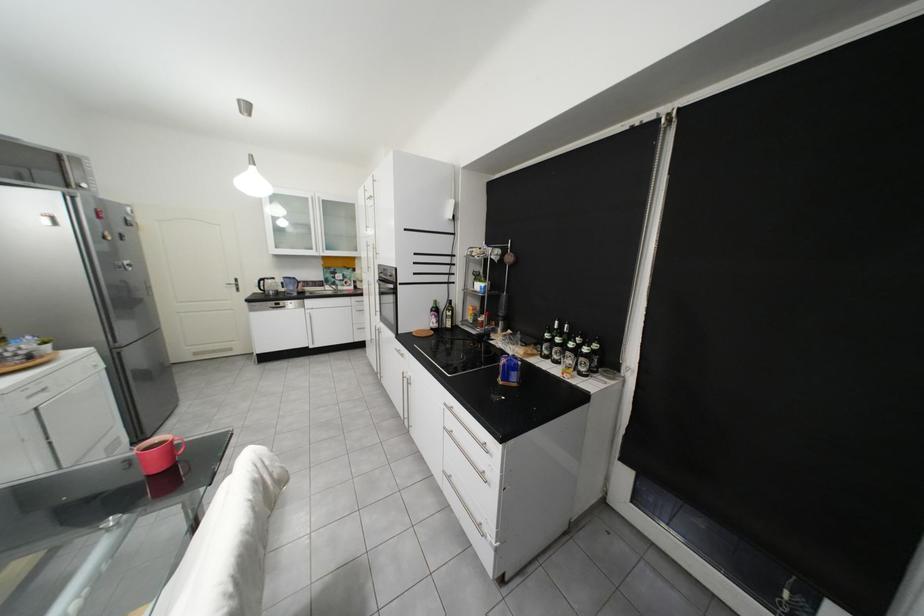
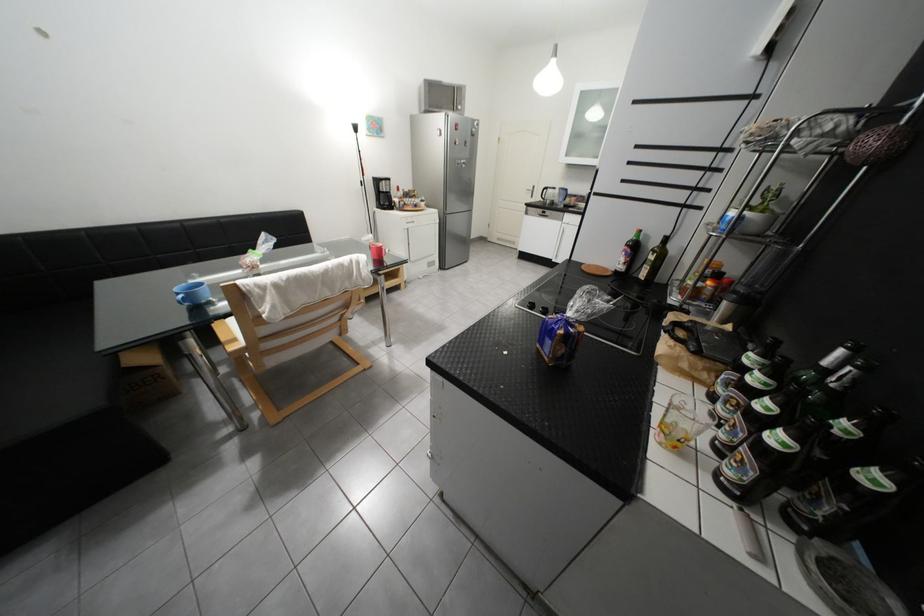
Locate, in the second image, the point that corresponds to the point at 249,281 in the first image.

(545, 188)